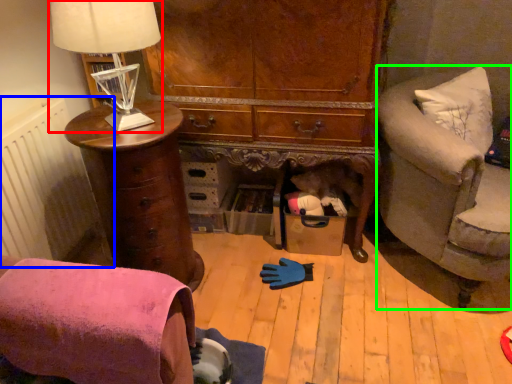
Question: Which object is the closest to the table lamp (highlighted by a red box)? Choose among these: radiator (highlighted by a blue box) or studio couch (highlighted by a green box).

Choices:
 (A) radiator
 (B) studio couch

Answer: (A)